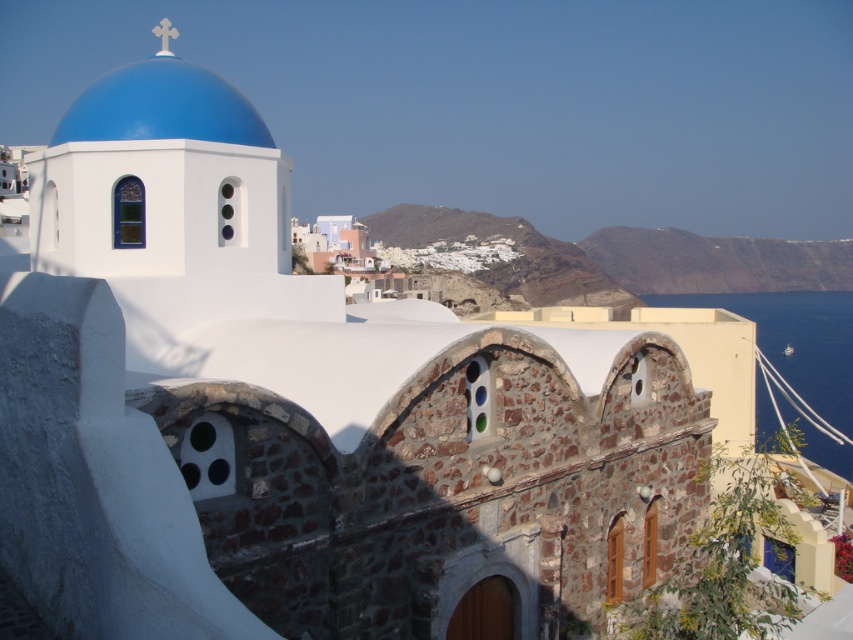
You are a photographer planning to capture the entire structure of the building in your shot. Given that the blue water at right and the blue painted dome at upper left are both in the frame, which one should you adjust your camera angle to prioritize including more of?

You should prioritize including more of the blue water at right because it might be wider than the blue painted dome at upper left, ensuring the entire structure fits within the frame.

You are an architect designing a model of this building. You have two blue paints available, one for the blue water at right and another for the blue painted dome at upper left. Which object requires more paint due to its larger size?

The blue water at right requires more paint because it is larger in size than the blue painted dome at upper left.